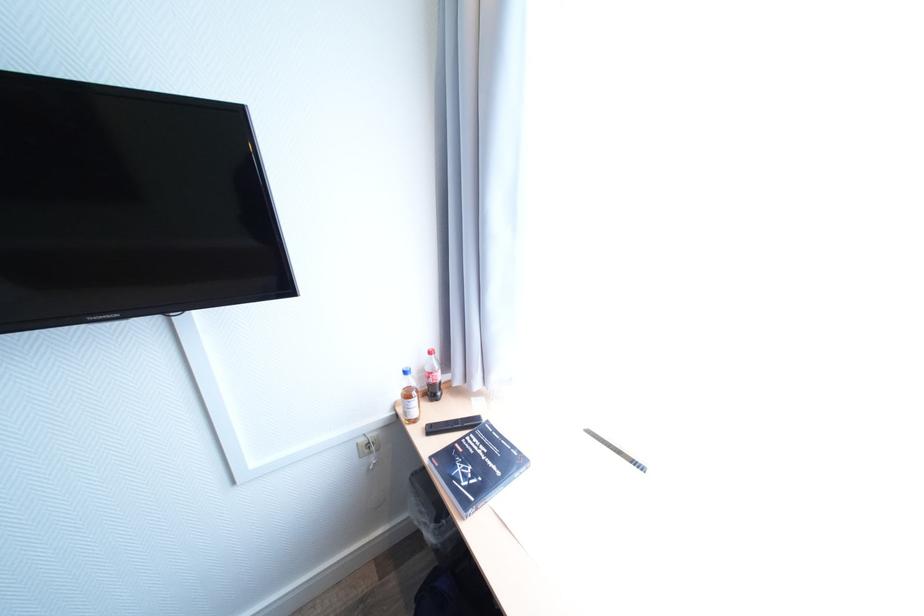
The image size is (924, 616). What are the coordinates of `grey curtain edge` in the screenshot? It's located at (468, 182).